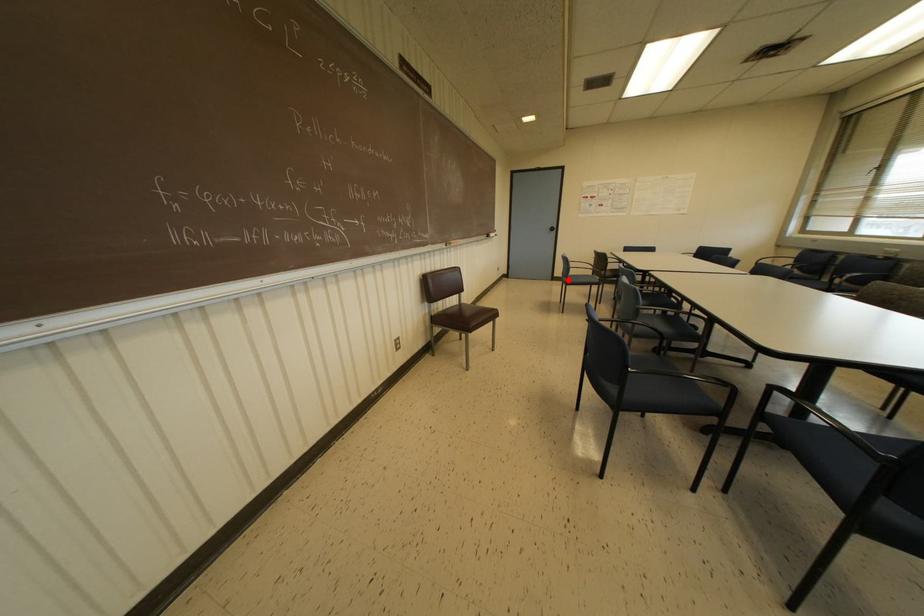
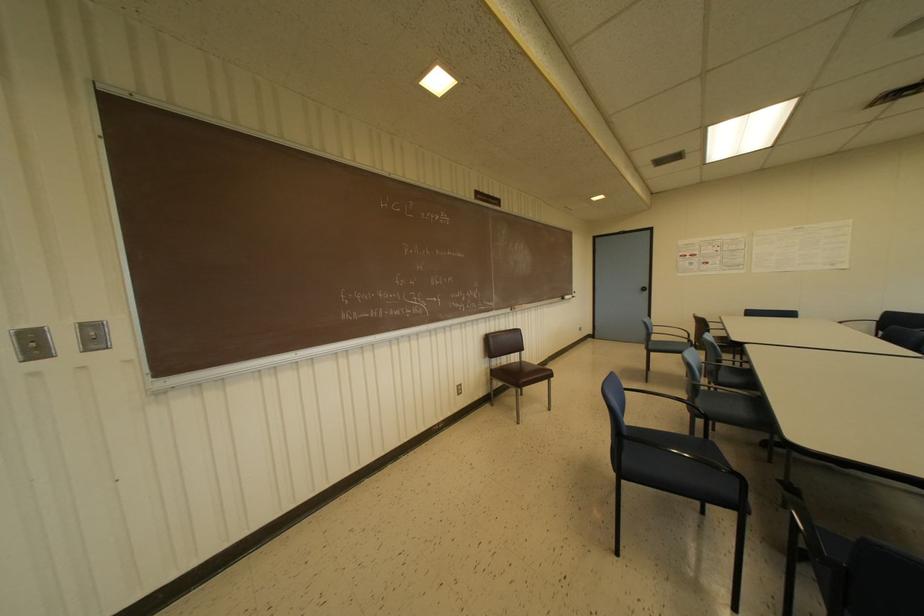
The point at the highlighted location is marked in the first image. Where is the corresponding point in the second image?

(650, 346)